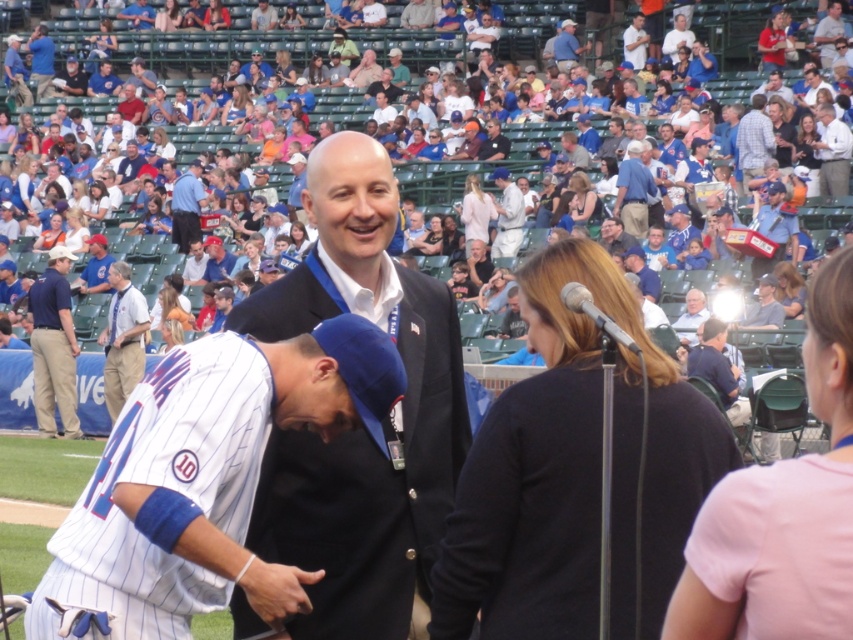
You are a photographer positioned at the center of the baseball stadium field. You want to take a photo that includes both the dark blue uniform at left and the blue jersey at left. Given that your camera has a maximum focus range of 20 feet, will both subjects be in focus?

The dark blue uniform at left and the blue jersey at left are 19.51 feet apart. Since the distance between them is within the camera maximum focus range of 20 feet, both subjects will be in focus.

You are a photographer at the baseball stadium and need to capture a photo of both the dark blue uniform at left and the blue jersey at left. Which one should you adjust your camera focus to first to ensure both are in frame?

The dark blue uniform at left is taller than the blue jersey at left, so you should focus on the dark blue uniform at left first to accommodate its height, ensuring both fit within the frame.

You are a photographer positioned at the center of the field. You need to capture a photo that includes both the dark blue uniform at left and the blue fabric shirt at upper left. Based on their widths, which object should you adjust your camera angle to focus on first to ensure both are in frame?

The dark blue uniform at left is wider than the blue fabric shirt at upper left, so you should focus on the dark blue uniform at left first to ensure both fit within the frame.